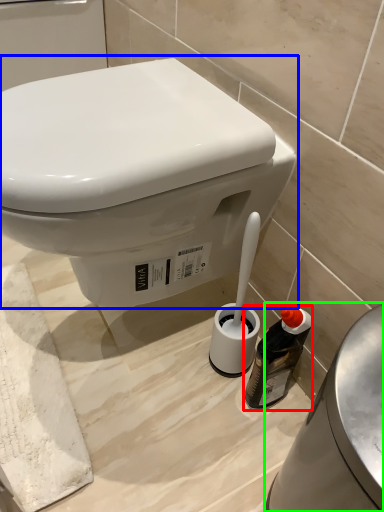
Question: Considering the real-world distances, which object is farthest from bottle (highlighted by a red box)? toilet (highlighted by a blue box) or porcelain (highlighted by a green box)?

Choices:
 (A) toilet
 (B) porcelain

Answer: (A)